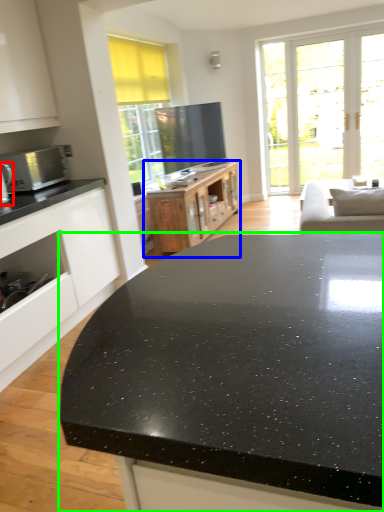
Question: Estimate the real-world distances between objects in this image. Which object is farther from appliance (highlighted by a red box), cabinetry (highlighted by a blue box) or countertop (highlighted by a green box)?

Choices:
 (A) cabinetry
 (B) countertop

Answer: (B)